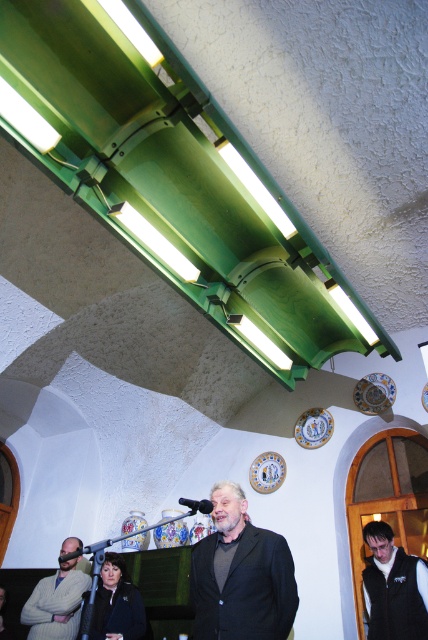
You are an event planner setting up a presentation. You need to place a decorative plate on the wall between the light gray sweater at lower left and the black matte microphone at lower left. Which object should you place it closer to if the plate is smaller than the microphone?

The light gray sweater at lower left is smaller than the black matte microphone at lower left. Since the decorative plate is also smaller than the microphone, it should be placed closer to the light gray sweater at lower left to maintain proportional spacing.

You are standing in the room and see the point at coordinates (240, 576). Which object is this point located on?

The point at coordinates (240, 576) is located on the dark gray suit at center.